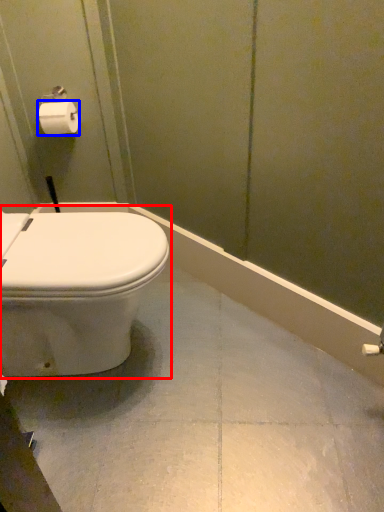
Question: Which object appears closest to the camera in this image, toilet (highlighted by a red box) or toilet paper (highlighted by a blue box)?

Choices:
 (A) toilet
 (B) toilet paper

Answer: (A)